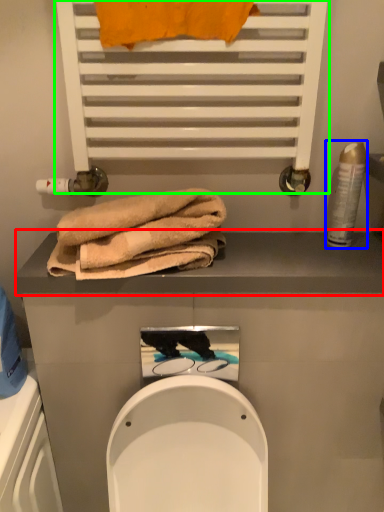
Question: Considering the real-world distances, which object is farthest from balustrade (highlighted by a red box)? toiletry (highlighted by a blue box) or shelf (highlighted by a green box)?

Choices:
 (A) toiletry
 (B) shelf

Answer: (B)